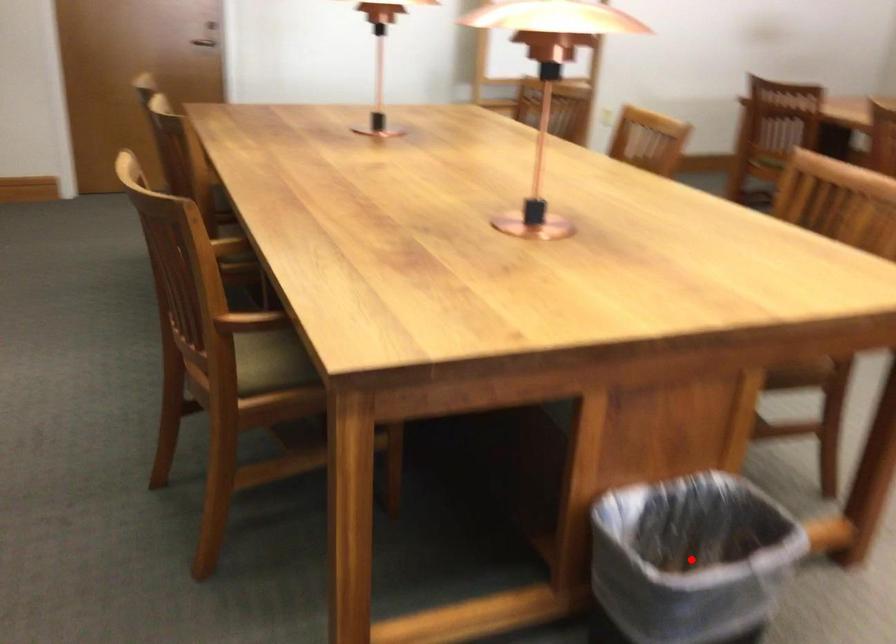
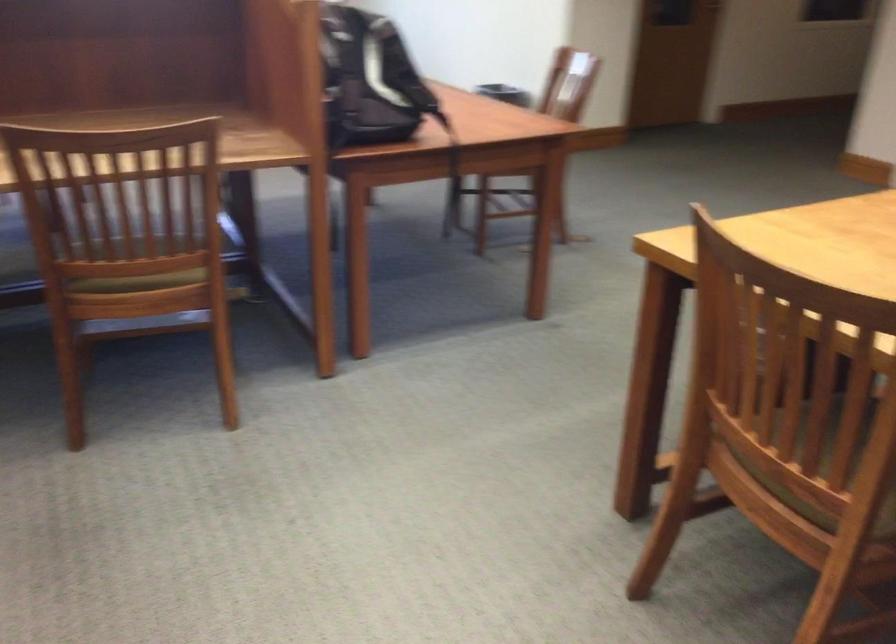
Question: I am providing you with two images of the same scene from different viewpoints. A red point is marked on the first image. Is the red point's position out of view in image 2?

Choices:
 (A) Yes
 (B) No

Answer: (A)